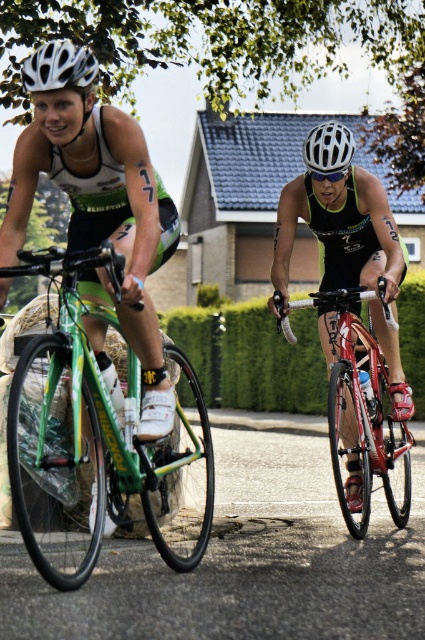
Which is below, green matte bicycle at left or white matte helmet at upper left?

green matte bicycle at left is below.

Is point (76, 465) farther from viewer compared to point (85, 68)?

That is True.

Is point (28, 525) closer to camera compared to point (91, 54)?

Yes, point (28, 525) is closer to viewer.

Identify the location of green matte bicycle at left. This screenshot has height=640, width=425. (90, 433).

Between point (45, 60) and point (328, 177), which one is positioned behind?

Positioned behind is point (328, 177).

How distant is white matte helmet at upper left from white matte goggles at center?

The distance of white matte helmet at upper left from white matte goggles at center is 2.19 meters.

Does point (47, 51) come farther from viewer compared to point (342, 170)?

That is False.

At what (x,y) coordinates should I click in order to perform the action: click on white matte helmet at upper left. Please return your answer as a coordinate pair (x, y). This screenshot has width=425, height=640. Looking at the image, I should click on (59, 67).

Does shiny red bicycle at center come behind white matte goggles at center?

No, it is not.

Does point (286, 323) come closer to viewer compared to point (314, 177)?

That is True.

Is point (334, 477) positioned behind point (342, 168)?

Yes, it is behind point (342, 168).

This screenshot has width=425, height=640. What are the coordinates of `shiny red bicycle at center` in the screenshot? It's located at (357, 401).